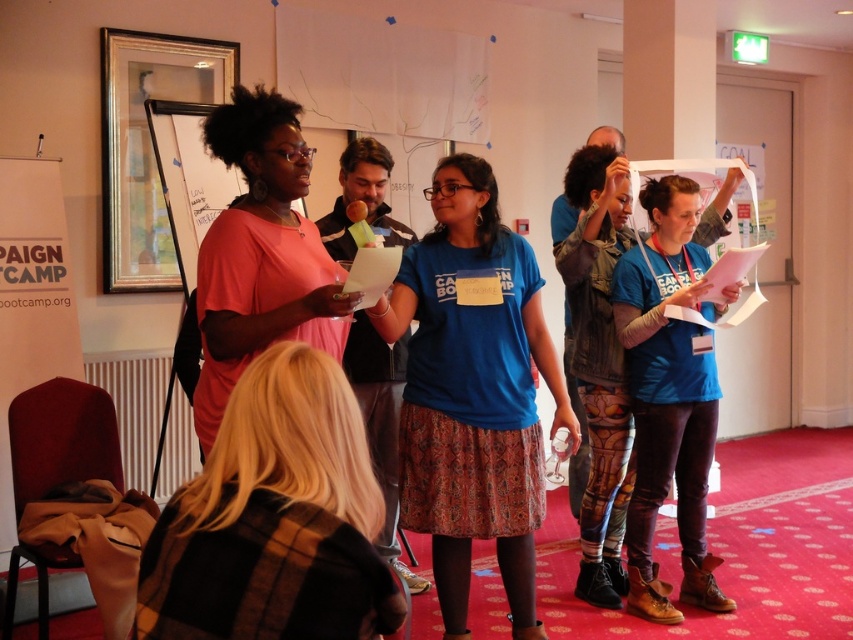
Question: Is blue cotton shirt at center to the right of white paper at left from the viewer's perspective?

Choices:
 (A) no
 (B) yes

Answer: (B)

Question: Can you confirm if matte pink dress at center is positioned above blue printed leggings at center?

Choices:
 (A) yes
 (B) no

Answer: (A)

Question: Which object appears closest to the camera in this image?

Choices:
 (A) matte pink dress at center
 (B) blue cotton shirt at center
 (C) blue cotton t-shirt at center
 (D) white paper at left

Answer: (A)

Question: Which of these objects is positioned farthest from the blue printed leggings at center?

Choices:
 (A) white paper at left
 (B) blue cotton t-shirt at center
 (C) plaid woolen sweater at center
 (D) matte pink dress at center

Answer: (A)

Question: Is matte pink dress at center thinner than blue printed leggings at center?

Choices:
 (A) yes
 (B) no

Answer: (B)

Question: Which object is positioned farthest from the blue printed leggings at center?

Choices:
 (A) matte pink dress at center
 (B) blue cotton shirt at center
 (C) blue cotton t-shirt at center
 (D) white paper at left

Answer: (D)